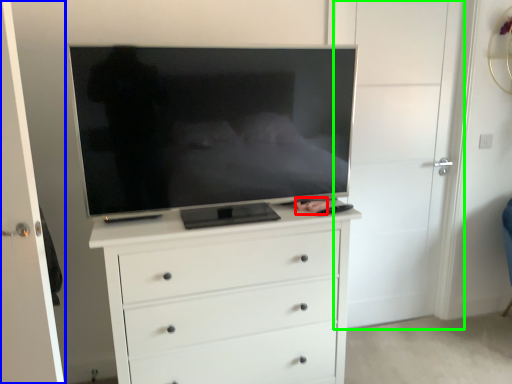
Question: Which object is the farthest from person (highlighted by a red box)? Choose among these: door (highlighted by a blue box) or door (highlighted by a green box).

Choices:
 (A) door
 (B) door

Answer: (A)